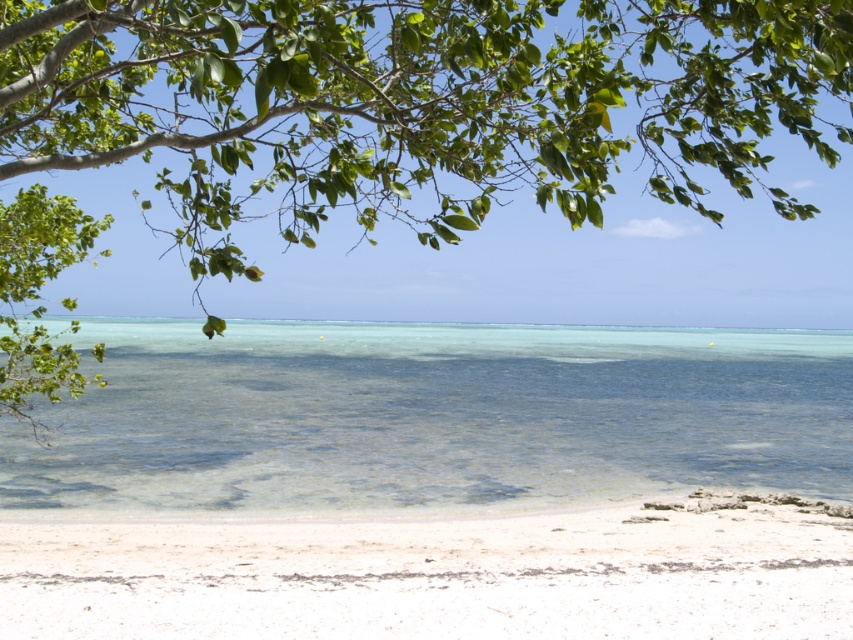
Who is taller, clear water at lower center or white sandy beach at lower center?

clear water at lower center

Does clear water at lower center have a lesser width compared to white sandy beach at lower center?

No, clear water at lower center is not thinner than white sandy beach at lower center.

Identify the location of clear water at lower center. (434, 417).

Find the location of a particular element. The image size is (853, 640). clear water at lower center is located at coordinates click(x=434, y=417).

At what (x,y) coordinates should I click in order to perform the action: click on green leafy tree at upper left. Please return your answer as a coordinate pair (x, y). The width and height of the screenshot is (853, 640). Looking at the image, I should click on (412, 104).

Does green leafy tree at upper left appear under clear water at lower center?

Incorrect, green leafy tree at upper left is not positioned below clear water at lower center.

What do you see at coordinates (412, 104) in the screenshot? I see `green leafy tree at upper left` at bounding box center [412, 104].

Where is `green leafy tree at upper left`? green leafy tree at upper left is located at coordinates (412, 104).

Is the position of green leafy tree at upper left less distant than that of white sandy beach at lower center?

Yes, it is.

The width and height of the screenshot is (853, 640). What do you see at coordinates (412, 104) in the screenshot?
I see `green leafy tree at upper left` at bounding box center [412, 104].

Which is in front, point (94, 67) or point (727, 499)?

Point (94, 67) is in front.

The image size is (853, 640). I want to click on green leafy tree at upper left, so click(x=412, y=104).